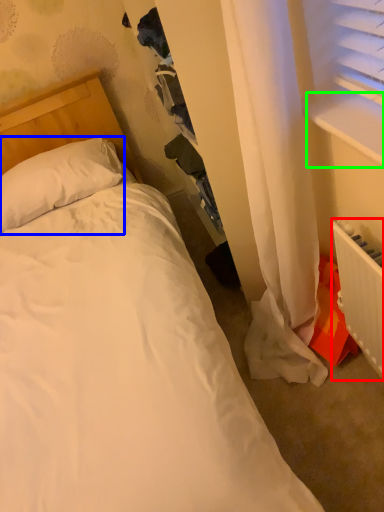
Question: Estimate the real-world distances between objects in this image. Which object is closer to radiator (highlighted by a red box), pillow (highlighted by a blue box) or window sill (highlighted by a green box)?

Choices:
 (A) pillow
 (B) window sill

Answer: (B)